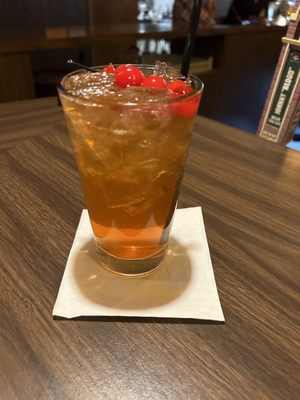
Identify the location of tissue. Image resolution: width=300 pixels, height=400 pixels. (183, 306).